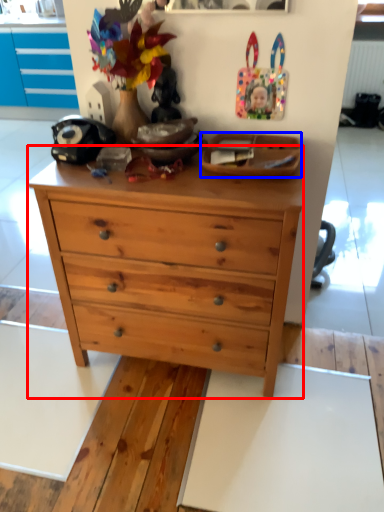
Question: Among these objects, which one is nearest to the camera, chest of drawers (highlighted by a red box) or plate (highlighted by a blue box)?

Choices:
 (A) chest of drawers
 (B) plate

Answer: (A)